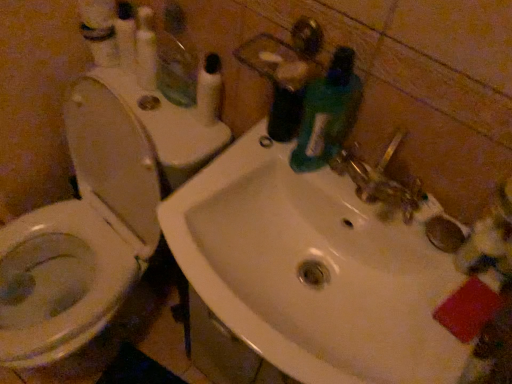
This screenshot has width=512, height=384. What are the coordinates of `white glossy toilet at left` in the screenshot? It's located at (81, 236).

Where is `white glossy toilet at left`? This screenshot has width=512, height=384. white glossy toilet at left is located at coordinates (81, 236).

Consider the image. Which object is wider, white glossy toilet at left or white plastic pump at upper center?

Wider between the two is white glossy toilet at left.

Who is taller, white glossy toilet at left or white plastic pump at upper center?

white glossy toilet at left.

I want to click on toilet that appears below the white plastic pump at upper center (from the image's perspective), so click(81, 236).

From a real-world perspective, is white glossy toilet at left located higher than white plastic pump at upper center?

No, from a real-world perspective, white glossy toilet at left is not above white plastic pump at upper center.

Between point (182, 58) and point (210, 55), which one is positioned in front?

The point (210, 55) is more forward.

Based on the photo, is white plastic pump at upper center at the back of clear glass mirror at upper left?

That's not correct — clear glass mirror at upper left is not looking away from white plastic pump at upper center.

How many degrees apart are the facing directions of clear glass mirror at upper left and white plastic pump at upper center?

The angular difference between clear glass mirror at upper left and white plastic pump at upper center is 5.37 degrees.

Is green rubber gloves at sink smaller than white plastic pump at upper center?

No, green rubber gloves at sink is not smaller than white plastic pump at upper center.

In the scene shown: How different are the orientations of green rubber gloves at sink and white plastic pump at upper center in degrees?

The facing directions of green rubber gloves at sink and white plastic pump at upper center are 0.35 degrees apart.

This screenshot has height=384, width=512. Identify the location of cleaning product below the white plastic pump at upper center (from the image's perspective). (327, 113).

Is white plastic pump at upper center located within green rubber gloves at sink?

No, white plastic pump at upper center is not inside green rubber gloves at sink.

Does white glossy toilet at left appear on the right side of clear glass mirror at upper left?

In fact, white glossy toilet at left is to the left of clear glass mirror at upper left.

Does white glossy toilet at left have a lesser width compared to clear glass mirror at upper left?

In fact, white glossy toilet at left might be wider than clear glass mirror at upper left.

From the image's perspective, does white glossy toilet at left appear higher than clear glass mirror at upper left?

No, from the image's perspective, white glossy toilet at left is not above clear glass mirror at upper left.

From a real-world perspective, is white glossy toilet at left positioned under green rubber gloves at sink based on gravity?

Yes, from a real-world perspective, white glossy toilet at left is beneath green rubber gloves at sink.

Locate an element on the screen. This screenshot has height=384, width=512. toilet below the green rubber gloves at sink (from a real-world perspective) is located at coordinates (81, 236).

Considering the relative positions of white glossy toilet at left and green rubber gloves at sink in the image provided, is white glossy toilet at left to the right of green rubber gloves at sink from the viewer's perspective?

No.

In the scene shown: Between white glossy toilet at left and green rubber gloves at sink, which one is positioned in front?

white glossy toilet at left is in front.

From a real-world perspective, between green rubber gloves at sink and clear glass mirror at upper left, who is vertically lower?

clear glass mirror at upper left.

Is green rubber gloves at sink positioned with its back to clear glass mirror at upper left?

green rubber gloves at sink is not turned away from clear glass mirror at upper left.

Is green rubber gloves at sink positioned in front of clear glass mirror at upper left?

Yes, it is in front of clear glass mirror at upper left.

Is white plastic pump at upper center further to the viewer compared to green rubber gloves at sink?

Yes, the depth of white plastic pump at upper center is greater than that of green rubber gloves at sink.

Can you confirm if white plastic pump at upper center is thinner than green rubber gloves at sink?

Yes, white plastic pump at upper center is thinner than green rubber gloves at sink.

From the image's perspective, is white plastic pump at upper center over green rubber gloves at sink?

Yes, from the image's perspective, white plastic pump at upper center is above green rubber gloves at sink.

You are a GUI agent. You are given a task and a screenshot of the screen. Output one action in this format:
    pyautogui.click(x=<x>, y=<y>)
    Task: Click on the toilet below the white plastic pump at upper center (from a real-world perspective)
    This screenshot has width=512, height=384.
    Given the screenshot: What is the action you would take?
    pyautogui.click(x=81, y=236)

The height and width of the screenshot is (384, 512). In order to click on mirror positioned vertically above the white plastic pump at upper center (from a real-world perspective) in this screenshot , I will do `click(176, 69)`.

When comparing their distances from white glossy sink at center, does clear glass mirror at upper left or white plastic pump at upper center seem closer?

Among the two, white plastic pump at upper center is located nearer to white glossy sink at center.

Which object lies further to the anchor point white glossy toilet at left, green rubber gloves at sink or white glossy sink at center?

green rubber gloves at sink is positioned further to the anchor white glossy toilet at left.

Which object lies nearer to the anchor point white glossy toilet at left, clear glass mirror at upper left or green rubber gloves at sink?

clear glass mirror at upper left is positioned closer to the anchor white glossy toilet at left.

Which object lies nearer to the anchor point white glossy sink at center, clear glass mirror at upper left or white glossy toilet at left?

The object closer to white glossy sink at center is white glossy toilet at left.

When comparing their distances from clear glass mirror at upper left, does white glossy sink at center or white plastic pump at upper center seem closer?

white plastic pump at upper center.

Considering their positions, is white glossy sink at center positioned further to green rubber gloves at sink than clear glass mirror at upper left?

clear glass mirror at upper left is positioned further to the anchor green rubber gloves at sink.

Estimate the real-world distances between objects in this image. Which object is closer to clear glass mirror at upper left, white glossy toilet at left or white plastic pump at upper center?

white plastic pump at upper center is positioned closer to the anchor clear glass mirror at upper left.

When comparing their distances from white glossy sink at center, does white plastic pump at upper center or green rubber gloves at sink seem closer?

The object closer to white glossy sink at center is green rubber gloves at sink.

I want to click on cleaning product between white plastic pump at upper center and white glossy sink at center in the vertical direction, so click(x=327, y=113).

You are a GUI agent. You are given a task and a screenshot of the screen. Output one action in this format:
    pyautogui.click(x=<x>, y=<y>)
    Task: Click on the mirror between white glossy toilet at left and white glossy sink at center
    This screenshot has width=512, height=384.
    Given the screenshot: What is the action you would take?
    pyautogui.click(x=176, y=69)

Find the location of a particular element. toiletry between white glossy toilet at left and green rubber gloves at sink from left to right is located at coordinates (209, 90).

I want to click on toiletry between clear glass mirror at upper left and green rubber gloves at sink, so click(x=209, y=90).